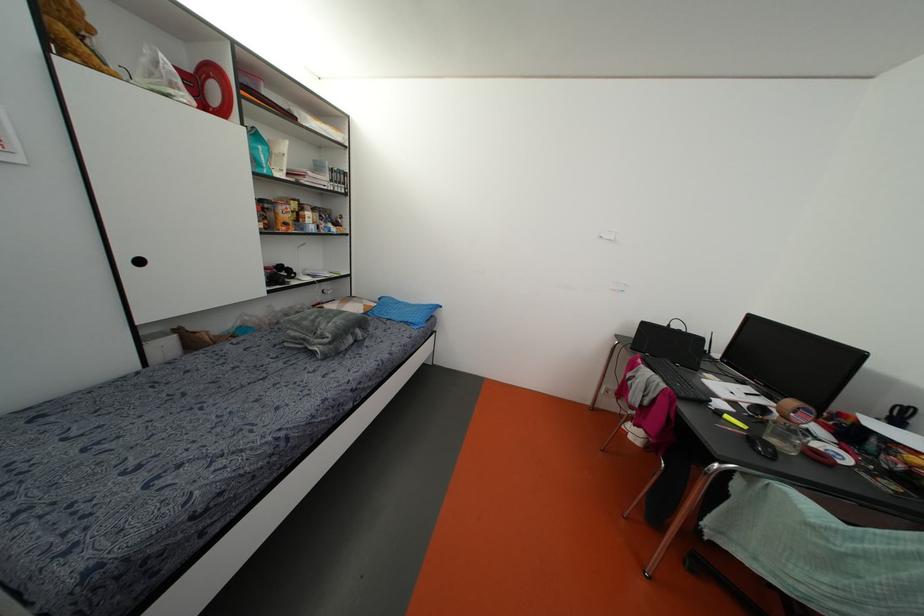
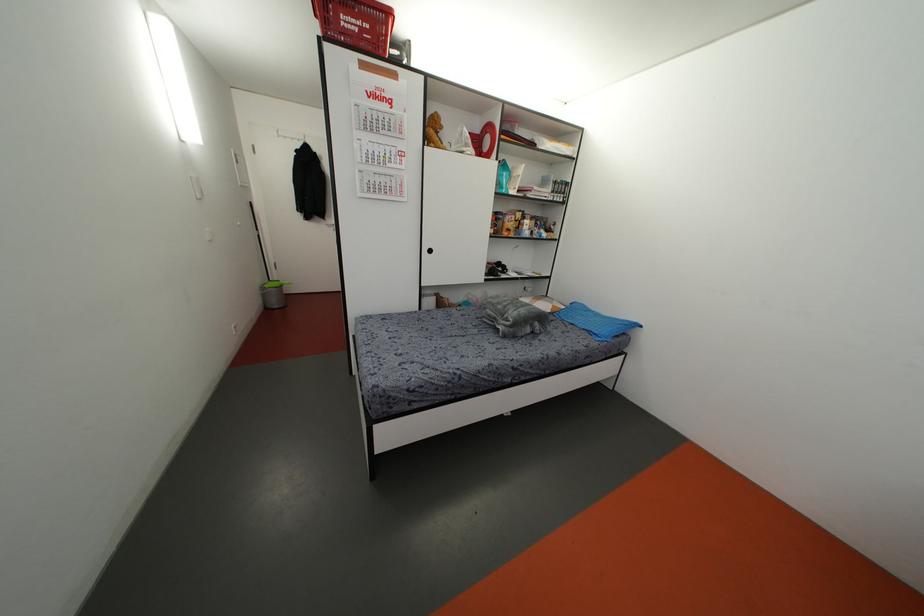
Locate, in the second image, the point that corresponds to the point at 203,106 in the first image.

(479, 153)